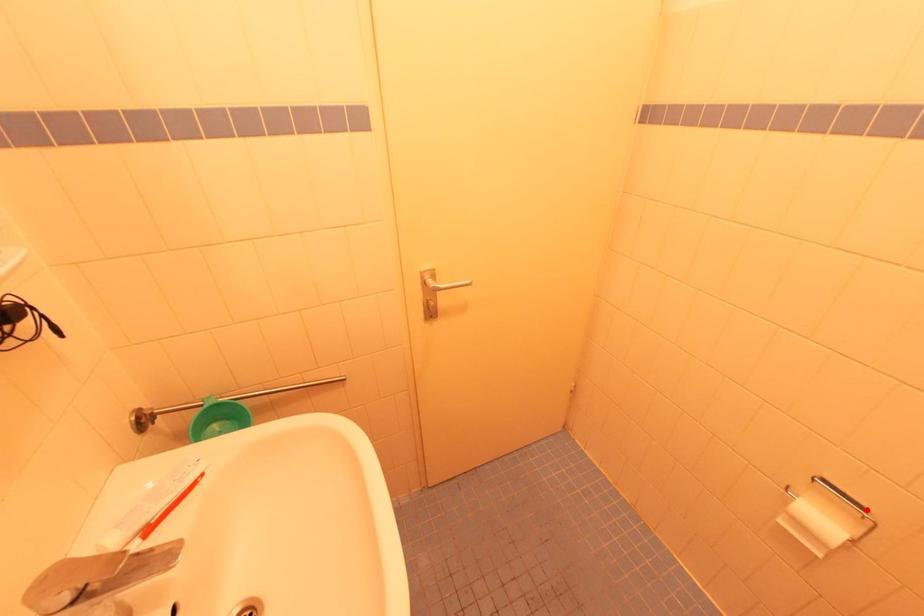
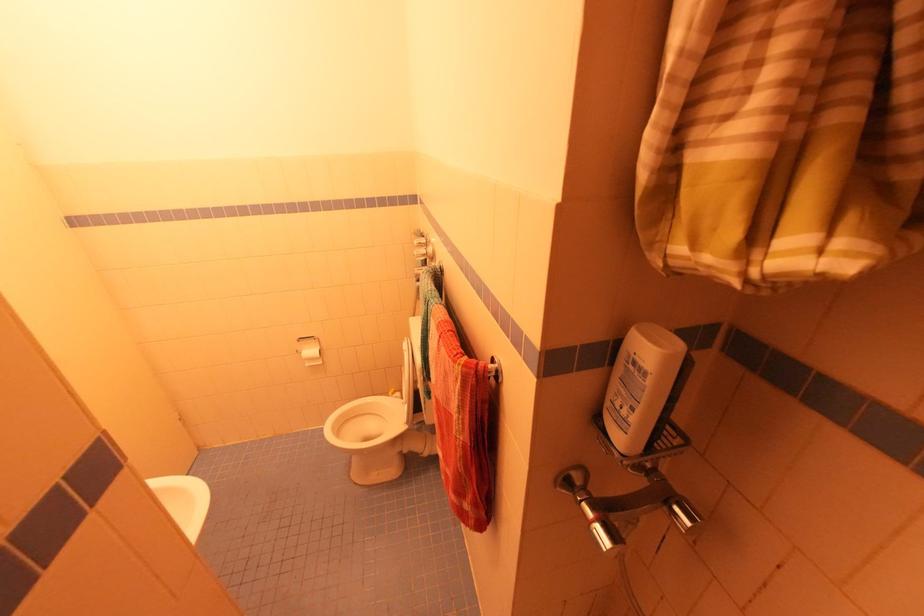
Where in the second image is the point corresponding to the highlighted location from the first image?

(314, 338)